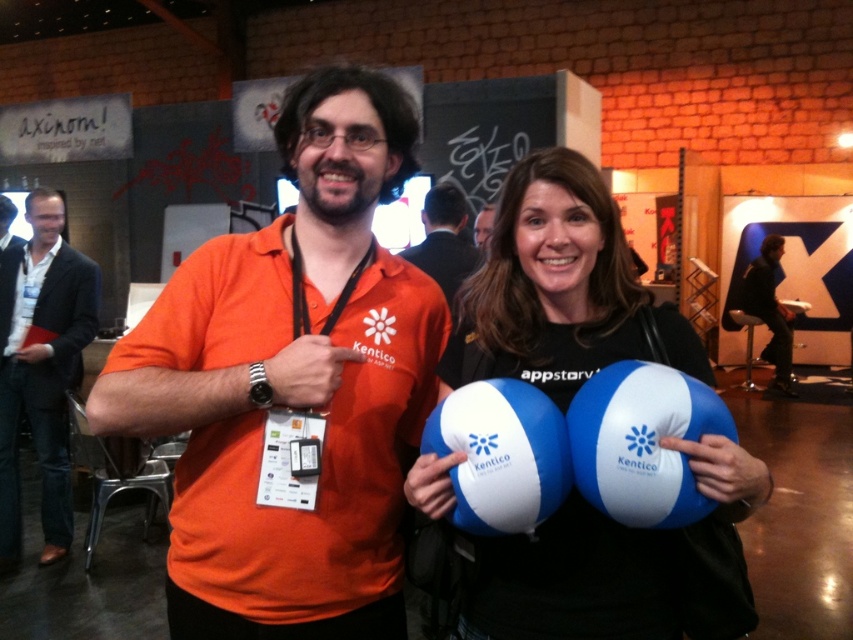
Question: Which object is the farthest from the matte black hair at upper center?

Choices:
 (A) white/inflatable beach ball at center
 (B) orange cotton shirt at center
 (C) dark blue suit at left
 (D) blue/white beach ball at center

Answer: (C)

Question: Is the position of blue/white beach ball at center more distant than that of white/inflatable beach ball at center?

Choices:
 (A) yes
 (B) no

Answer: (B)

Question: Which point appears farthest from the camera in this image?

Choices:
 (A) (434, 449)
 (B) (453, 209)
 (C) (476, 221)

Answer: (C)

Question: Does orange cotton shirt at center appear over dark blue suit at left?

Choices:
 (A) yes
 (B) no

Answer: (A)

Question: Which of the following is the closest to the observer?

Choices:
 (A) (637, 321)
 (B) (454, 252)
 (C) (480, 220)
 (D) (71, 278)

Answer: (A)

Question: Can you confirm if blue rubber balloons at center is positioned to the left of blue/white beach ball at center?

Choices:
 (A) yes
 (B) no

Answer: (A)